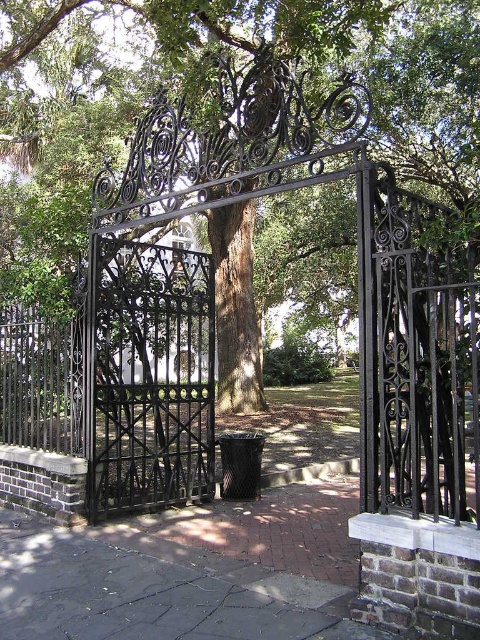
Question: Does green leafy tree at center appear on the left side of black wrought iron gate at center?

Choices:
 (A) yes
 (B) no

Answer: (A)

Question: Can you confirm if green leafy tree at center is positioned to the right of black wrought iron gate at center?

Choices:
 (A) yes
 (B) no

Answer: (B)

Question: Which point is closer to the camera?

Choices:
 (A) coord(90,339)
 (B) coord(228,300)

Answer: (A)

Question: Is green leafy tree at center positioned in front of black wrought iron gate at center?

Choices:
 (A) no
 (B) yes

Answer: (B)

Question: Which point appears closest to the camera in this image?

Choices:
 (A) (217, 397)
 (B) (143, 332)

Answer: (B)